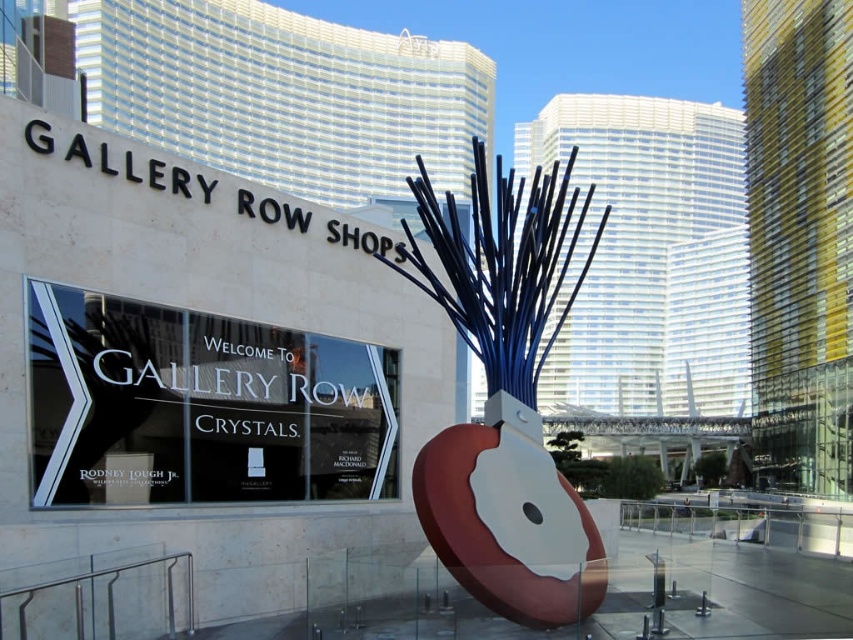
Question: Which point is closer to the camera taking this photo?

Choices:
 (A) (578, 577)
 (B) (148, 496)

Answer: (A)

Question: Which point is farther from the camera taking this photo?

Choices:
 (A) (219, 332)
 (B) (490, 516)

Answer: (A)

Question: Is white glass sign at center thinner than matte blue metal spikes at center?

Choices:
 (A) no
 (B) yes

Answer: (B)

Question: Where is white glass sign at center located in relation to matte blue metal spikes at center in the image?

Choices:
 (A) below
 (B) above

Answer: (A)

Question: Does white glass sign at center have a lesser width compared to matte blue metal spikes at center?

Choices:
 (A) yes
 (B) no

Answer: (A)